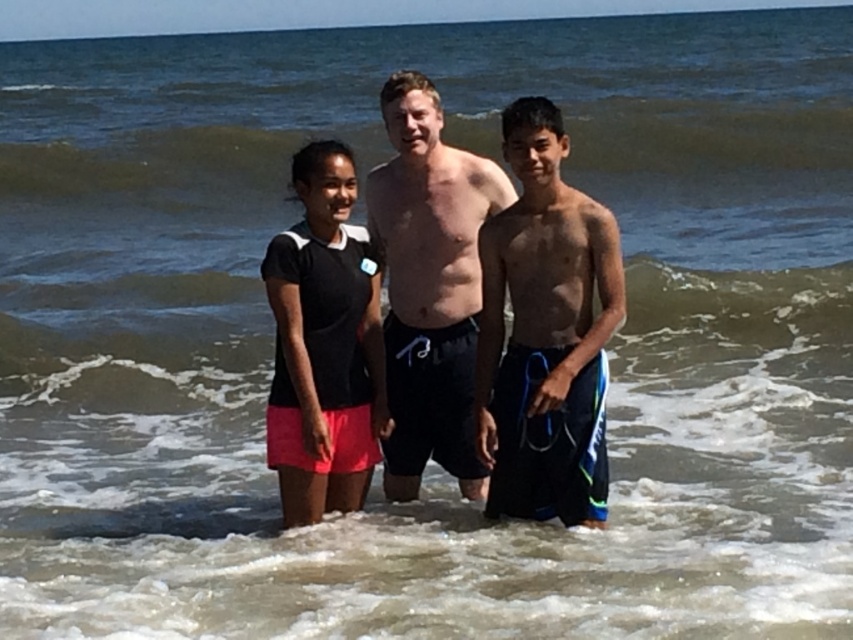
Is point (491, 205) farther from viewer compared to point (360, 380)?

Yes, point (491, 205) is behind point (360, 380).

Describe the element at coordinates (428, 285) in the screenshot. This screenshot has width=853, height=640. I see `black matte shorts at center` at that location.

Is point (482, 161) farther from camera compared to point (294, 275)?

That is True.

At what (x,y) coordinates should I click in order to perform the action: click on black matte shorts at center. Please return your answer as a coordinate pair (x, y). This screenshot has height=640, width=853. Looking at the image, I should click on (428, 285).

Which is more to the right, blue striped shorts at center or black matte shorts at center?

blue striped shorts at center is more to the right.

Does blue striped shorts at center lie in front of black matte shorts at center?

That is True.

The width and height of the screenshot is (853, 640). I want to click on blue striped shorts at center, so click(544, 332).

Does blue striped shorts at center have a smaller size compared to black matte skirt at center?

Actually, blue striped shorts at center might be larger than black matte skirt at center.

Who is positioned more to the left, blue striped shorts at center or black matte skirt at center?

black matte skirt at center

Is point (572, 349) less distant than point (305, 164)?

That is True.

Find the location of a particular element. Image resolution: width=853 pixels, height=640 pixels. blue striped shorts at center is located at coordinates (544, 332).